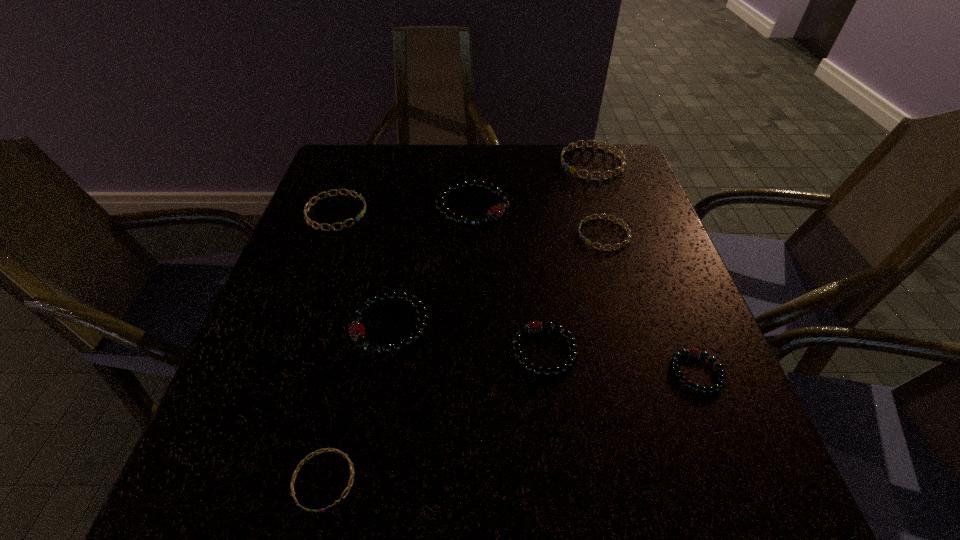
Find the location of `vacant region at the far left corner of the desktop`. vacant region at the far left corner of the desktop is located at coordinates [325, 192].

Where is `vacant space at the far right corner of the desktop`? The width and height of the screenshot is (960, 540). vacant space at the far right corner of the desktop is located at coordinates (598, 152).

What are the coordinates of `vacant space at the near right corner of the desktop` in the screenshot? It's located at (698, 514).

Where is `vacant area that lies between the second smallest blue bracelet and the farthest bracelet`? The height and width of the screenshot is (540, 960). vacant area that lies between the second smallest blue bracelet and the farthest bracelet is located at coordinates (598, 199).

Locate an element on the screen. Image resolution: width=960 pixels, height=540 pixels. free space that is in between the farthest object and the tallest bracelet is located at coordinates (532, 185).

You are a GUI agent. You are given a task and a screenshot of the screen. Output one action in this format:
    pyautogui.click(x=<x>, y=<y>)
    Task: Click on the free point between the smallest black bracelet and the tallest object
    This screenshot has width=960, height=540.
    Given the screenshot: What is the action you would take?
    pyautogui.click(x=585, y=290)

Find the location of a particular element. The height and width of the screenshot is (540, 960). free space between the smallest black bracelet and the second smallest black bracelet is located at coordinates (620, 362).

At what (x,y) coordinates should I click in order to perform the action: click on free area in between the rightmost black bracelet and the shortest bracelet. Please return your answer as a coordinate pair (x, y). Looking at the image, I should click on pyautogui.click(x=511, y=427).

Where is `free space between the second biggest black bracelet and the leftmost object`? free space between the second biggest black bracelet and the leftmost object is located at coordinates (363, 269).

At what (x,y) coordinates should I click in order to perform the action: click on blank region between the third biggest blue bracelet and the tallest bracelet. Please return your answer as a coordinate pair (x, y). This screenshot has width=960, height=540. Looking at the image, I should click on (538, 221).